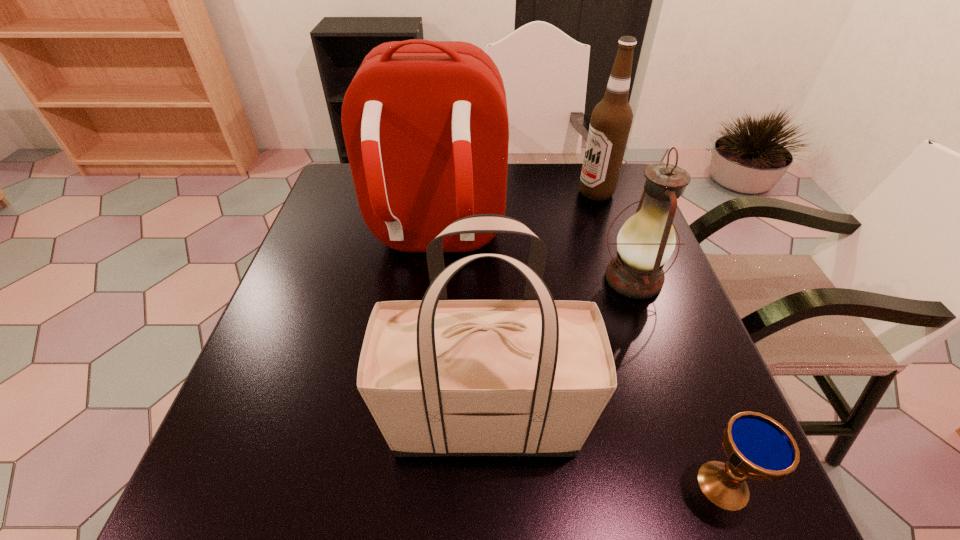
This screenshot has width=960, height=540. Identify the location of vacant space in between the shortest object and the shopping bag. (604, 453).

This screenshot has width=960, height=540. Find the location of `unoccupied position between the shortest object and the shopping bag`. unoccupied position between the shortest object and the shopping bag is located at coordinates (604, 453).

The height and width of the screenshot is (540, 960). Identify the location of vacant space in between the second shortest object and the chalice. (678, 382).

This screenshot has width=960, height=540. What are the coordinates of `free point between the backpack and the alcohol` in the screenshot? It's located at (516, 215).

In order to click on empty space between the alcohol and the shortest object in this screenshot , I will do `click(660, 339)`.

Identify the location of vacant area that lies between the alcohol and the backpack. (516, 215).

Identify the location of empty space between the alcohol and the backpack. (516, 215).

Identify the location of object that stands as the closest to the fourth tallest object. (531, 377).

Where is `the closest object to the second shortest object`? the closest object to the second shortest object is located at coordinates (531, 377).

The image size is (960, 540). I want to click on free space that satisfies the following two spatial constraints: 1. on the strap side of the backpack; 2. on the left side of the shortest object, so click(405, 485).